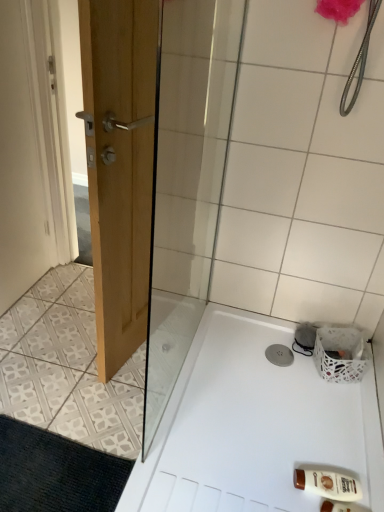
Question: From a real-world perspective, is white woven basket at lower right positioned above or below brown plastic bottle at lower right?

Choices:
 (A) above
 (B) below

Answer: (A)

Question: In the image, is white woven basket at lower right positioned in front of or behind brown plastic bottle at lower right?

Choices:
 (A) front
 (B) behind

Answer: (B)

Question: Considering the real-world distances, which object is closest to the white woven basket at lower right?

Choices:
 (A) white plastic bath at lower right
 (B) brown plastic bottle at lower right
 (C) black textured bath mat at lower left

Answer: (A)

Question: Which is nearer to the brown plastic bottle at lower right?

Choices:
 (A) white woven basket at lower right
 (B) white plastic bath at lower right
 (C) black textured bath mat at lower left

Answer: (B)